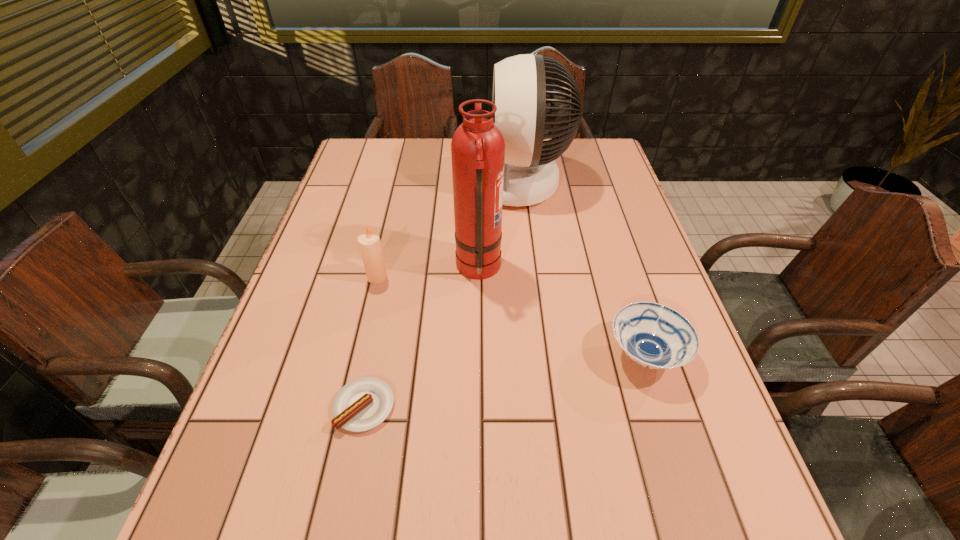
You are a GUI agent. You are given a task and a screenshot of the screen. Output one action in this format:
    pyautogui.click(x=<x>, y=<y>)
    Task: Click on the free region that satisfies the following two spatial constraints: 1. on the grille of the soup bowl; 2. on the left side of the fan
    The image size is (960, 540).
    Given the screenshot: What is the action you would take?
    pyautogui.click(x=539, y=355)

You are a GUI agent. You are given a task and a screenshot of the screen. Output one action in this format:
    pyautogui.click(x=<x>, y=<y>)
    Task: Click on the vacant space that satisfies the following two spatial constraints: 1. on the front side of the candle; 2. on the right side of the sausage
    
    Given the screenshot: What is the action you would take?
    pyautogui.click(x=348, y=406)